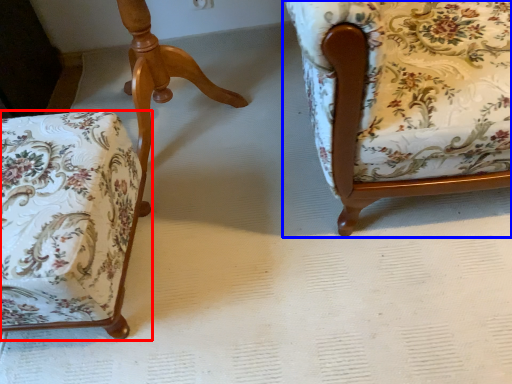
Question: Which of the following is the farthest to the observer, chair (highlighted by a red box) or chair (highlighted by a blue box)?

Choices:
 (A) chair
 (B) chair

Answer: (A)